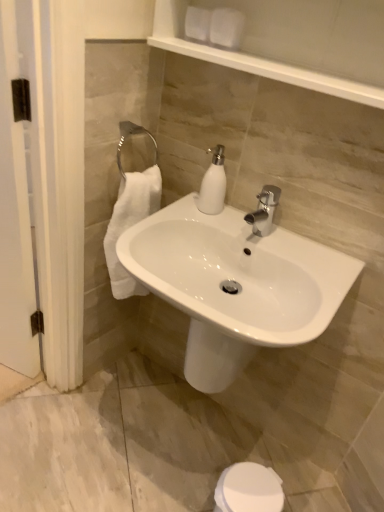
You are a GUI agent. You are given a task and a screenshot of the screen. Output one action in this format:
    pyautogui.click(x=<x>, y=<y>)
    Task: Click on the vacant area that lies in front of white wood screen door at left
    The height and width of the screenshot is (512, 384).
    Given the screenshot: What is the action you would take?
    pyautogui.click(x=17, y=402)